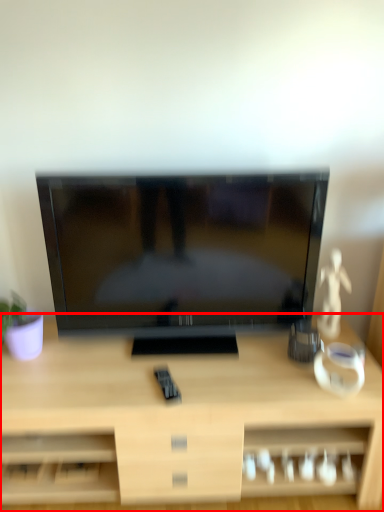
Question: From the image's perspective, what is the correct spatial relationship of desk (annotated by the red box) in relation to television?

Choices:
 (A) below
 (B) above

Answer: (A)